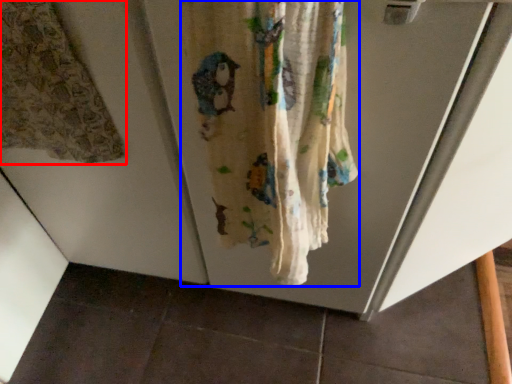
Question: Which of the following is the farthest to the observer, curtain (highlighted by a red box) or curtain (highlighted by a blue box)?

Choices:
 (A) curtain
 (B) curtain

Answer: (A)